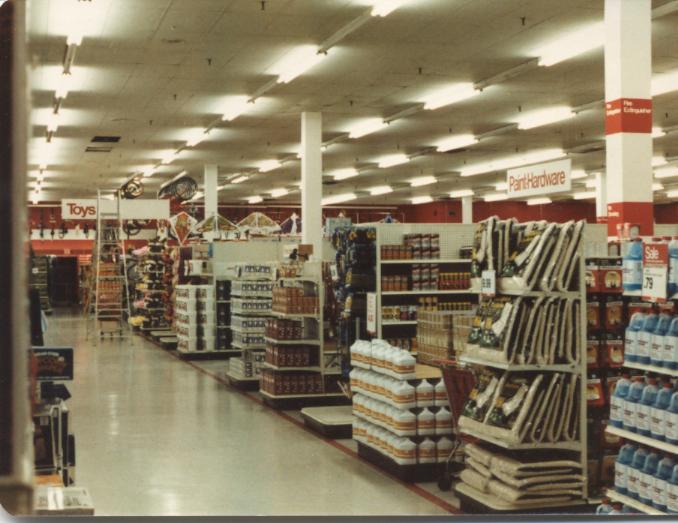
This screenshot has width=678, height=523. I want to click on column, so click(x=211, y=199), click(x=308, y=181), click(x=634, y=92), click(x=466, y=217).